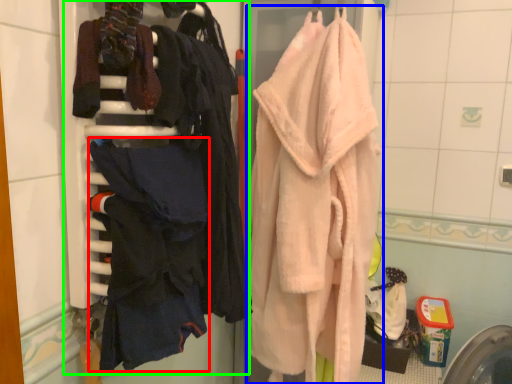
Question: Which object is positioned closest to clothing (highlighted by a red box)? Select from towel (highlighted by a blue box) and closet (highlighted by a green box).

Choices:
 (A) towel
 (B) closet

Answer: (B)